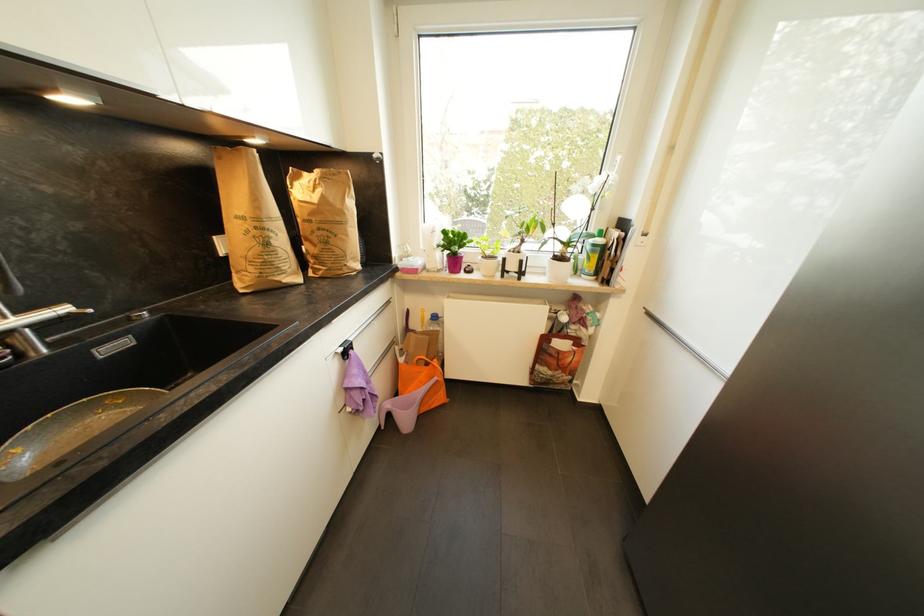
Where would you pull the metal faucet handle? Please return your answer as a coordinate pair (x, y).

(38, 315)